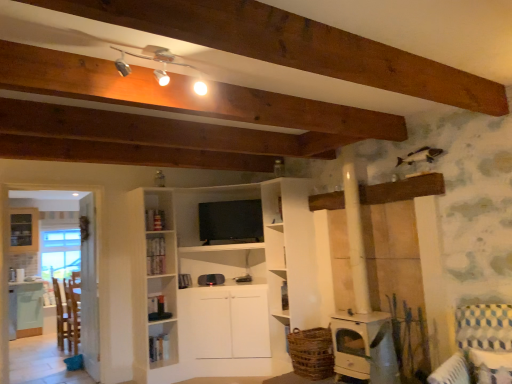
Question: From a real-world perspective, is silver metallic track lights at upper center beneath blue and white checkered fabric armchair at lower right?

Choices:
 (A) yes
 (B) no

Answer: (B)

Question: Considering the relative sizes of silver metallic track lights at upper center and blue and white checkered fabric armchair at lower right in the image provided, is silver metallic track lights at upper center thinner than blue and white checkered fabric armchair at lower right?

Choices:
 (A) no
 (B) yes

Answer: (B)

Question: Is silver metallic track lights at upper center taller than blue and white checkered fabric armchair at lower right?

Choices:
 (A) yes
 (B) no

Answer: (B)

Question: Does silver metallic track lights at upper center appear on the right side of blue and white checkered fabric armchair at lower right?

Choices:
 (A) yes
 (B) no

Answer: (B)

Question: Is silver metallic track lights at upper center closer to the viewer compared to blue and white checkered fabric armchair at lower right?

Choices:
 (A) no
 (B) yes

Answer: (B)

Question: Is point (98, 355) positioned closer to the camera than point (168, 57)?

Choices:
 (A) farther
 (B) closer

Answer: (A)

Question: Is transparent glass door at left taller or shorter than silver metallic track lights at upper center?

Choices:
 (A) short
 (B) tall

Answer: (B)

Question: Relative to silver metallic track lights at upper center, is transparent glass door at left in front or behind?

Choices:
 (A) behind
 (B) front

Answer: (A)

Question: Is transparent glass door at left bigger or smaller than silver metallic track lights at upper center?

Choices:
 (A) small
 (B) big

Answer: (B)

Question: Considering their positions, is silver metallic track lights at upper center located in front of or behind white matte wood stove at lower center?

Choices:
 (A) front
 (B) behind

Answer: (A)

Question: From a real-world perspective, relative to white matte wood stove at lower center, is silver metallic track lights at upper center vertically above or below?

Choices:
 (A) below
 (B) above

Answer: (B)

Question: Is silver metallic track lights at upper center inside the boundaries of white matte wood stove at lower center, or outside?

Choices:
 (A) inside
 (B) outside

Answer: (B)

Question: Is silver metallic track lights at upper center wider or thinner than white matte wood stove at lower center?

Choices:
 (A) thin
 (B) wide

Answer: (A)

Question: In terms of height, does wooden chair at left look taller or shorter compared to silver metallic track lights at upper center?

Choices:
 (A) short
 (B) tall

Answer: (B)

Question: In the image, is wooden chair at left on the left side or the right side of silver metallic track lights at upper center?

Choices:
 (A) right
 (B) left

Answer: (B)